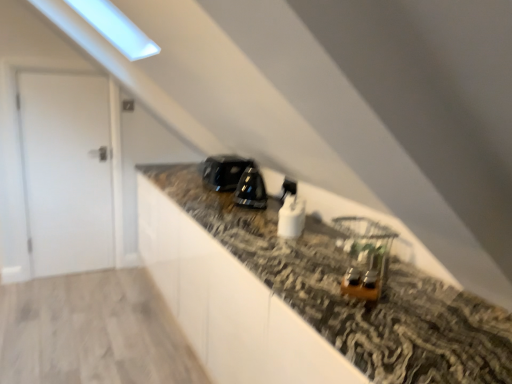
Question: Is glossy black toaster at center, placed as the fifth appliance when sorted from front to back, shorter than white glossy plug at center, the 4th appliance positioned from the left?

Choices:
 (A) yes
 (B) no

Answer: (B)

Question: Can you confirm if glossy black toaster at center, acting as the fifth appliance starting from the right, is bigger than white glossy plug at center, the 4th appliance positioned from the left?

Choices:
 (A) yes
 (B) no

Answer: (A)

Question: Could you tell me if glossy black toaster at center, which is counted as the 1th appliance, starting from the back, is turned towards white glossy plug at center, the 2th appliance viewed from the right?

Choices:
 (A) yes
 (B) no

Answer: (B)

Question: Can you confirm if glossy black toaster at center, placed as the fifth appliance when sorted from front to back, is taller than white glossy plug at center, the 4th appliance positioned from the left?

Choices:
 (A) no
 (B) yes

Answer: (B)

Question: Is glossy black toaster at center, placed as the fifth appliance when sorted from front to back, outside of white glossy plug at center, the second appliance positioned from the back?

Choices:
 (A) yes
 (B) no

Answer: (A)

Question: Does glossy black toaster at center, placed as the fifth appliance when sorted from front to back, have a lesser width compared to white glossy plug at center, which is counted as the fourth appliance, starting from the front?

Choices:
 (A) no
 (B) yes

Answer: (A)

Question: Is black glossy kettle at center, which is the 2th appliance from left to right, in contact with white matte door at left?

Choices:
 (A) yes
 (B) no

Answer: (B)

Question: Is black glossy kettle at center, which is the 2th appliance from left to right, oriented away from white matte door at left?

Choices:
 (A) yes
 (B) no

Answer: (B)

Question: Is black glossy kettle at center, which is the 2th appliance from left to right, to the right of white matte door at left from the viewer's perspective?

Choices:
 (A) yes
 (B) no

Answer: (A)

Question: From the image's perspective, is black glossy kettle at center, which is counted as the 4th appliance, starting from the right, above white matte door at left?

Choices:
 (A) no
 (B) yes

Answer: (A)

Question: Can you confirm if black glossy kettle at center, marked as the third appliance in a front-to-back arrangement, is thinner than white matte door at left?

Choices:
 (A) no
 (B) yes

Answer: (A)

Question: Considering the relative sizes of black glossy kettle at center, which is the 2th appliance from left to right, and white matte door at left in the image provided, is black glossy kettle at center, which is the 2th appliance from left to right, smaller than white matte door at left?

Choices:
 (A) yes
 (B) no

Answer: (A)

Question: Considering the relative sizes of wooden earrings at center, which ranks as the first appliance in front-to-back order, and black glossy kettle at center, which is the 2th appliance from left to right, in the image provided, is wooden earrings at center, which ranks as the first appliance in front-to-back order, shorter than black glossy kettle at center, which is the 2th appliance from left to right,?

Choices:
 (A) no
 (B) yes

Answer: (B)